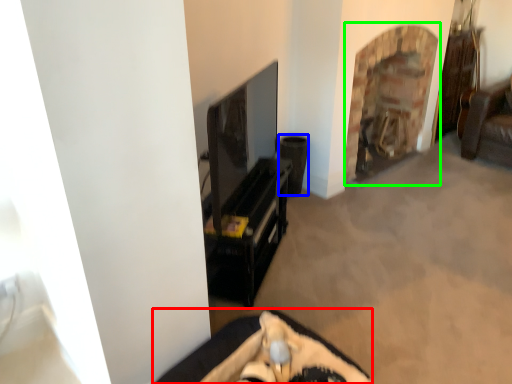
Question: Based on their relative distances, which object is farther from furniture (highlighted by a red box)? Choose from speaker (highlighted by a blue box) and fireplace (highlighted by a green box).

Choices:
 (A) speaker
 (B) fireplace

Answer: (B)